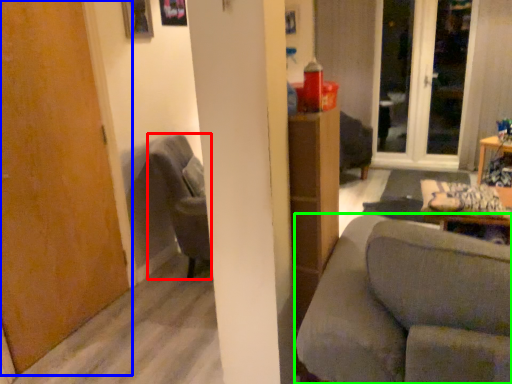
Question: Based on their relative distances, which object is farther from chair (highlighted by a red box)? Choose from door (highlighted by a blue box) and studio couch (highlighted by a green box).

Choices:
 (A) door
 (B) studio couch

Answer: (B)